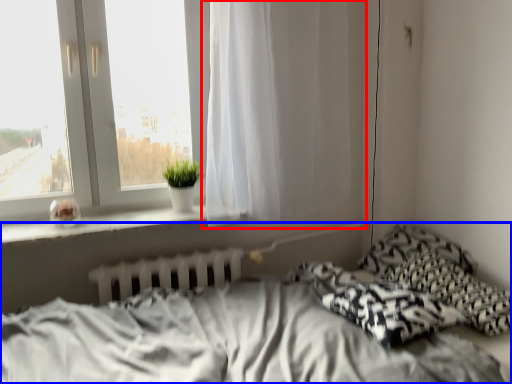
Question: Which object appears closest to the camera in this image, curtain (highlighted by a red box) or bed (highlighted by a blue box)?

Choices:
 (A) curtain
 (B) bed

Answer: (B)